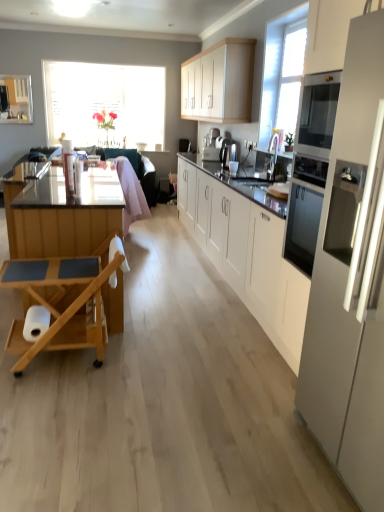
Where is `vacant area that is in front of satin silver coffee machine at center`? vacant area that is in front of satin silver coffee machine at center is located at coordinates (237, 166).